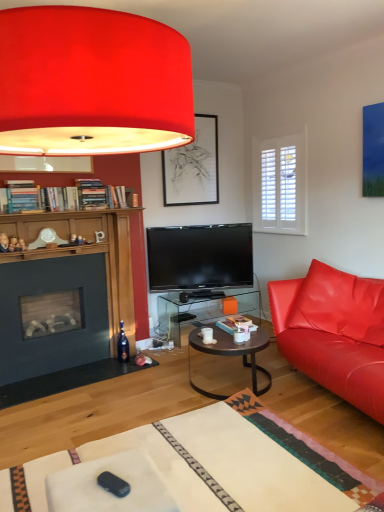
Locate an element on the screen. This screenshot has width=384, height=512. free location to the right of black plastic remote control at lower center is located at coordinates [148, 487].